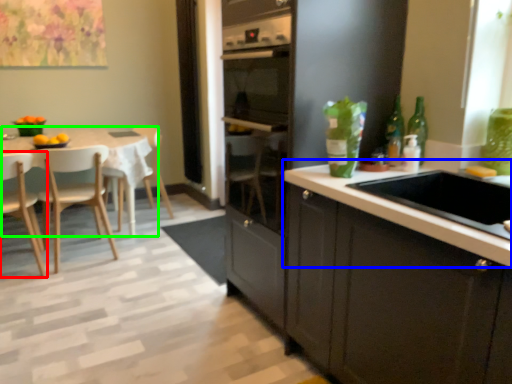
Question: Considering the real-world distances, which object is closest to chair (highlighted by a red box)? countertop (highlighted by a blue box) or kitchen & dining room table (highlighted by a green box).

Choices:
 (A) countertop
 (B) kitchen & dining room table

Answer: (B)